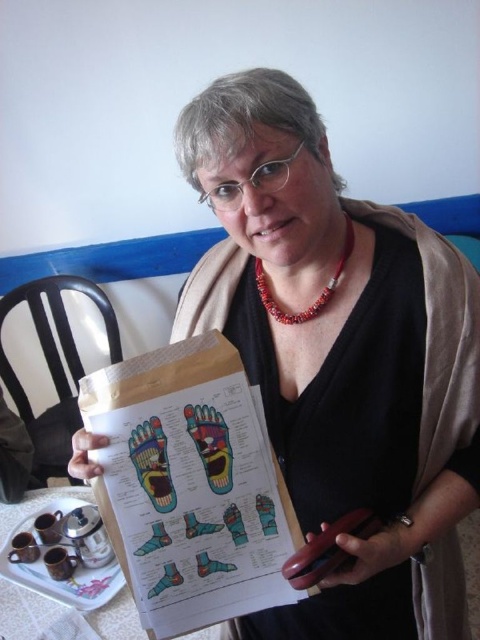
Question: Which point is closer to the camera taking this photo?

Choices:
 (A) (159, 397)
 (B) (115, 593)

Answer: (A)

Question: Does white ceramic tray at lower left appear on the right side of red coral necklace at center?

Choices:
 (A) no
 (B) yes

Answer: (A)

Question: Considering the real-world distances, which object is closest to the red coral necklace at center?

Choices:
 (A) paperboard clipboard at center
 (B) black matte paper at center

Answer: (B)

Question: Observing the image, what is the correct spatial positioning of white ceramic tray at lower left in reference to red coral necklace at center?

Choices:
 (A) left
 (B) right

Answer: (A)

Question: Is the position of paperboard clipboard at center less distant than that of red coral necklace at center?

Choices:
 (A) yes
 (B) no

Answer: (A)

Question: Which point is closer to the camera taking this photo?

Choices:
 (A) (211, 436)
 (B) (348, 250)

Answer: (A)